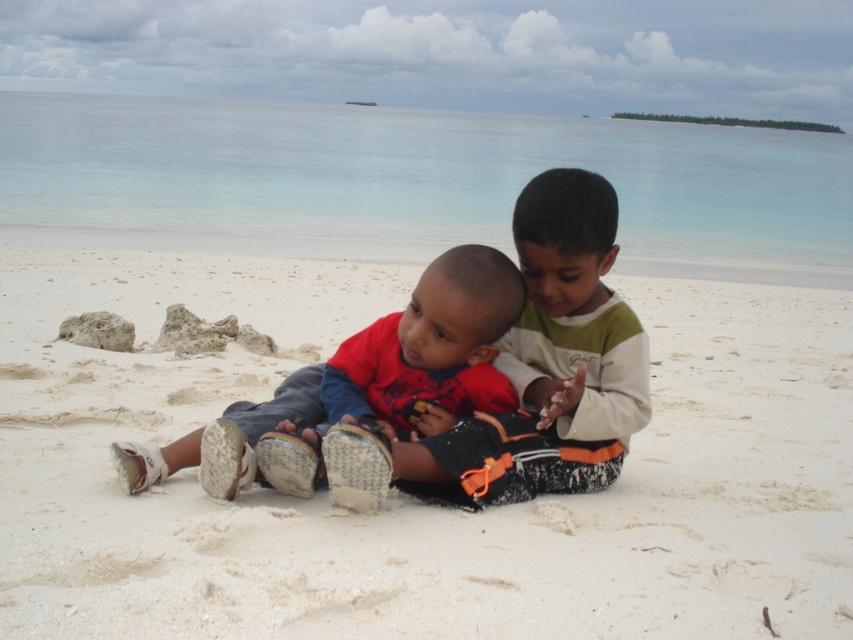
Question: Does white sandy beach at center appear on the left side of matte red shirt at center?

Choices:
 (A) no
 (B) yes

Answer: (B)

Question: Which object appears farthest from the camera in this image?

Choices:
 (A) white sandy beach at center
 (B) matte red shirt at center

Answer: (B)

Question: Can you confirm if white sandy beach at center is thinner than matte red shirt at center?

Choices:
 (A) no
 (B) yes

Answer: (B)

Question: Which of the following is the closest to the observer?

Choices:
 (A) matte red shirt at center
 (B) white sandy beach at center

Answer: (B)

Question: Can you confirm if white sandy beach at center is wider than matte red shirt at center?

Choices:
 (A) no
 (B) yes

Answer: (A)